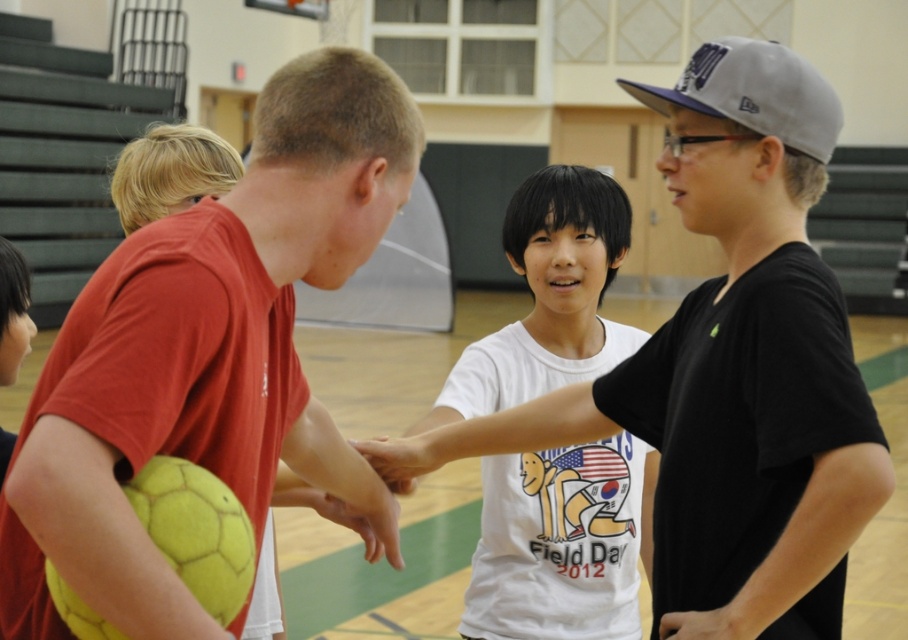
You are a gym teacher observing the gymnasium. You see the matte yellow soccer ball at left and the white matte shirt at center. Which object is narrower in width?

The matte yellow soccer ball at left has a lesser width compared to the white matte shirt at center, so the matte yellow soccer ball at left is narrower.

You are a photographer positioned at the back of the gymnasium. You want to take a photo of the white cotton shirt at center and the matte yellow soccer ball at left. To ensure both are in frame, should you adjust your camera to a wider angle or a narrower angle?

Since the matte yellow soccer ball at left is to the left of the white cotton shirt at center, they are positioned side by side horizontally. To capture both in the same frame without cropping, you should use a wider angle to accommodate their horizontal distance apart.

You are a gym teacher observing the gymnasium and notice the matte yellow soccer ball at left and the white matte shirt at center. Which object is positioned farther to the left side of the gymnasium?

The matte yellow soccer ball at left is positioned farther to the left side of the gymnasium compared to the white matte shirt at center.